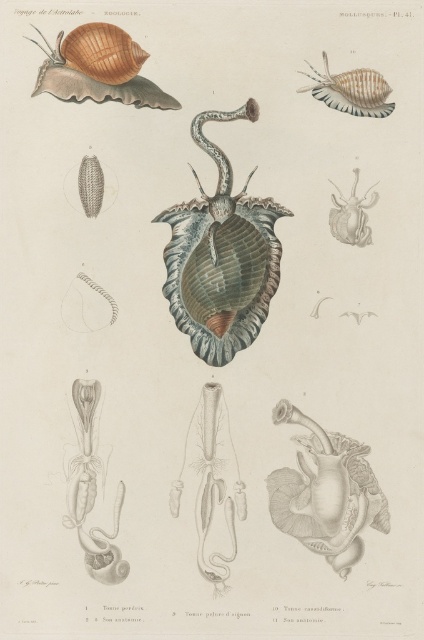
Question: Which object appears farthest from the camera in this image?

Choices:
 (A) matte white snail at upper right
 (B) matte brown shell at upper left

Answer: (A)

Question: Does matte brown shell at upper left appear on the left side of matte white snail at upper right?

Choices:
 (A) no
 (B) yes

Answer: (B)

Question: Does shiny metallic shell at center have a larger size compared to matte white snail at upper right?

Choices:
 (A) no
 (B) yes

Answer: (B)

Question: Is smooth white shell at center wider than matte brown shell at upper left?

Choices:
 (A) yes
 (B) no

Answer: (B)

Question: Among these points, which one is nearest to the camera?

Choices:
 (A) (97, 52)
 (B) (219, 116)
 (C) (362, 477)
 (D) (360, 227)

Answer: (A)

Question: Considering the real-world distances, which object is closest to the matte brown shell at upper left?

Choices:
 (A) shiny beige shell at upper right
 (B) shiny metallic shell at center
 (C) matte white snail at upper right

Answer: (B)